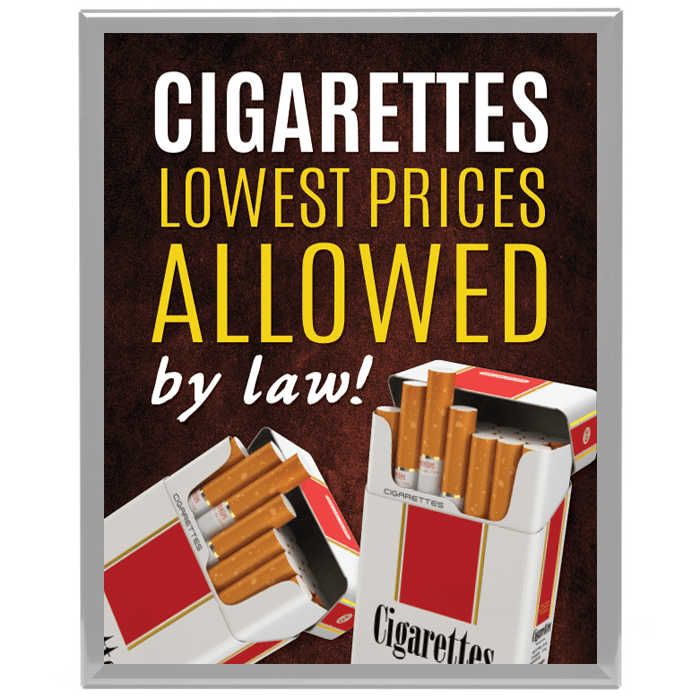
Locate an element on the screen. poster is located at coordinates (146, 49).